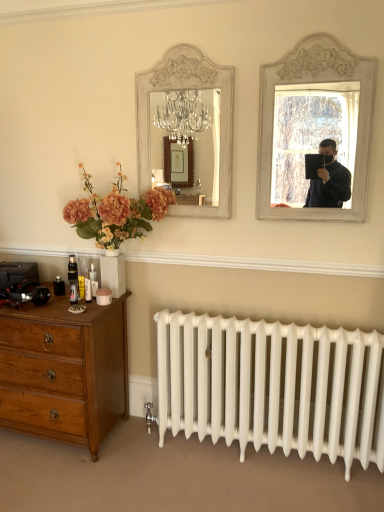
Image resolution: width=384 pixels, height=512 pixels. I want to click on empty space that is ontop of white painted wood mirror at upper right (from a real-world perspective), so click(319, 28).